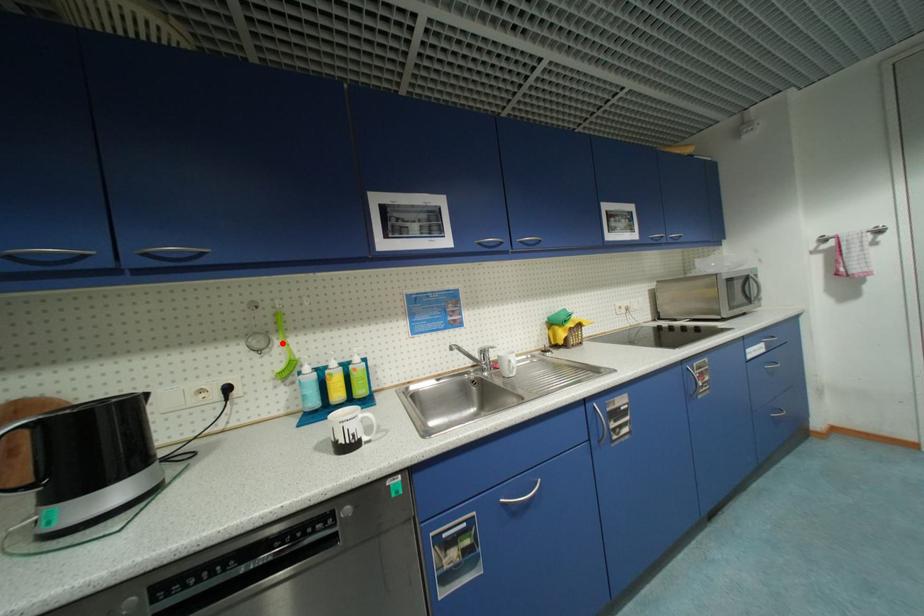
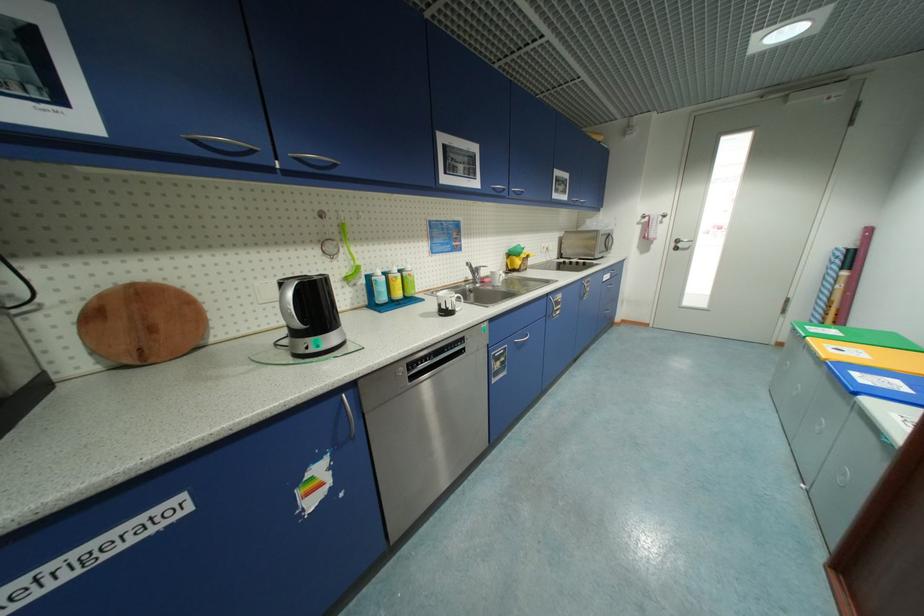
Find the pixel in the second image that matches the highlighted location in the first image.

(347, 251)